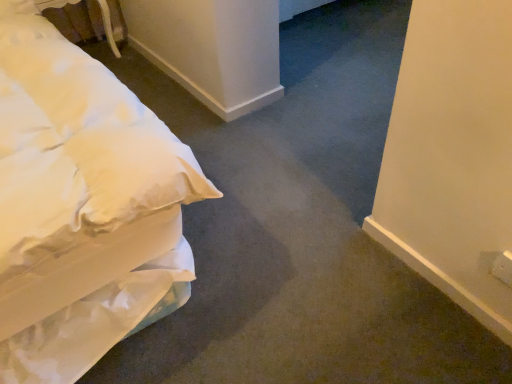
The height and width of the screenshot is (384, 512). I want to click on white fabric bed at upper left, so click(x=108, y=27).

In the scene shown: What is the approximate width of white fabric bed at upper left?

white fabric bed at upper left is 41.14 centimeters in width.

What is the approximate height of white fabric bed at upper left?

white fabric bed at upper left is 16.53 inches in height.

The width and height of the screenshot is (512, 384). Describe the element at coordinates (108, 27) in the screenshot. I see `white fabric bed at upper left` at that location.

Where is `white soft bed at left`? white soft bed at left is located at coordinates (80, 203).

The image size is (512, 384). What do you see at coordinates (80, 203) in the screenshot?
I see `white soft bed at left` at bounding box center [80, 203].

This screenshot has width=512, height=384. Find the location of `white fabric bed at upper left`. white fabric bed at upper left is located at coordinates (108, 27).

Based on the photo, between white soft bed at left and white fabric bed at upper left, which one appears on the right side from the viewer's perspective?

white soft bed at left.

Does white soft bed at left come in front of white fabric bed at upper left?

Yes, white soft bed at left is closer to the camera.

Does point (177, 190) come behind point (49, 4)?

No, it is not.

From the image's perspective, does white soft bed at left appear higher than white fabric bed at upper left?

No.

From a real-world perspective, which is physically below, white soft bed at left or white fabric bed at upper left?

From a 3D spatial view, white fabric bed at upper left is below.

Is white soft bed at left wider or thinner than white fabric bed at upper left?

Considering their sizes, white soft bed at left looks broader than white fabric bed at upper left.

Which of these two, white soft bed at left or white fabric bed at upper left, stands taller?

white soft bed at left is taller.

Considering the sizes of objects white soft bed at left and white fabric bed at upper left in the image provided, who is smaller, white soft bed at left or white fabric bed at upper left?

white fabric bed at upper left is smaller.

Does white soft bed at left contain white fabric bed at upper left?

Actually, white fabric bed at upper left is outside white soft bed at left.

Is white soft bed at left directly adjacent to white fabric bed at upper left?

white soft bed at left is not next to white fabric bed at upper left, and they're not touching.

Is white soft bed at left looking in the opposite direction of white fabric bed at upper left?

No, white soft bed at left is not facing away from white fabric bed at upper left.

In the scene shown: What's the angular difference between white soft bed at left and white fabric bed at upper left's facing directions?

0.883 degrees separate the facing orientations of white soft bed at left and white fabric bed at upper left.

Locate an element on the screen. The height and width of the screenshot is (384, 512). table below the white soft bed at left (from a real-world perspective) is located at coordinates (108, 27).

Does white fabric bed at upper left appear on the right side of white soft bed at left?

No.

Considering their positions, is white fabric bed at upper left located in front of or behind white soft bed at left?

In the image, white fabric bed at upper left appears behind white soft bed at left.

Is point (111, 49) farther from camera compared to point (40, 218)?

That is True.

From the image's perspective, is white fabric bed at upper left above or below white soft bed at left?

Based on their image positions, white fabric bed at upper left is located above white soft bed at left.

From a real-world perspective, does white fabric bed at upper left stand above white soft bed at left?

No, from a real-world perspective, white fabric bed at upper left is not over white soft bed at left

Which object is thinner, white fabric bed at upper left or white soft bed at left?

With smaller width is white fabric bed at upper left.

In the scene shown: Which of these two, white fabric bed at upper left or white soft bed at left, stands taller?

white soft bed at left.

Based on their sizes in the image, would you say white fabric bed at upper left is bigger or smaller than white soft bed at left?

Considering their sizes, white fabric bed at upper left takes up less space than white soft bed at left.

Do you think white fabric bed at upper left is within white soft bed at left, or outside of it?

The correct answer is: outside.

Is white fabric bed at upper left in contact with white soft bed at left?

No, white fabric bed at upper left is not beside white soft bed at left.

Could you tell me if white fabric bed at upper left is turned towards white soft bed at left?

No, white fabric bed at upper left is not oriented towards white soft bed at left.

Locate an element on the screen. The height and width of the screenshot is (384, 512). table above the white soft bed at left (from the image's perspective) is located at coordinates (108, 27).

This screenshot has height=384, width=512. What are the coordinates of `table beneath the white soft bed at left (from a real-world perspective)` in the screenshot? It's located at (108, 27).

Identify the location of table to the left of white soft bed at left. The height and width of the screenshot is (384, 512). (108, 27).